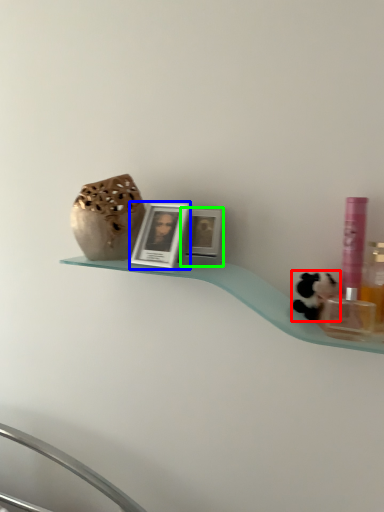
Question: Which object is positioned farthest from animal (highlighted by a red box)? Select from picture frame (highlighted by a blue box) and picture frame (highlighted by a green box).

Choices:
 (A) picture frame
 (B) picture frame

Answer: (A)